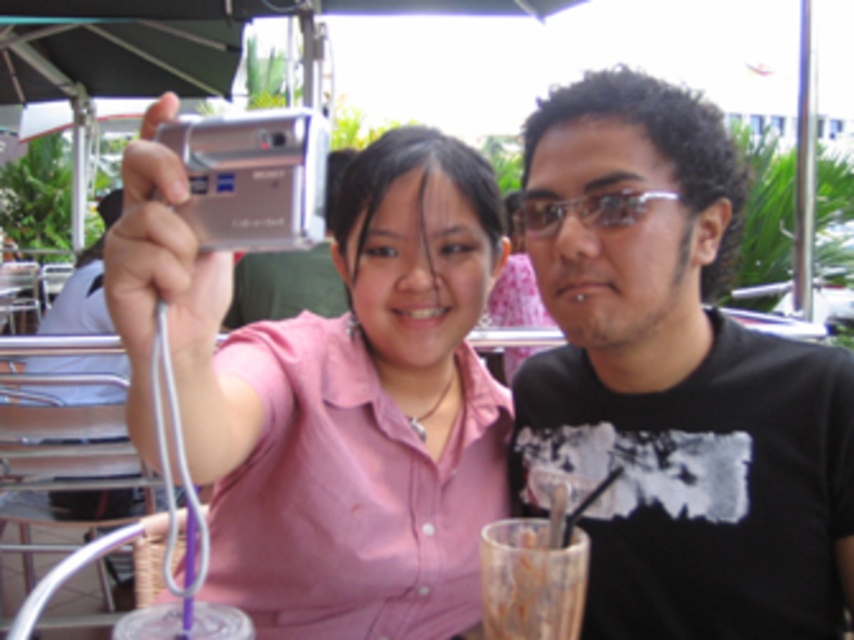
Question: Can you confirm if black matte shirt at right is wider than translucent plastic cup at lower center?

Choices:
 (A) no
 (B) yes

Answer: (B)

Question: Does black matte shirt at right appear on the left side of silver metallic camera at upper left?

Choices:
 (A) yes
 (B) no

Answer: (B)

Question: Which object appears farthest from the camera in this image?

Choices:
 (A) black matte shirt at right
 (B) transparent plastic glasses at center

Answer: (B)

Question: Considering the relative positions of black matte shirt at right and transparent plastic glasses at center in the image provided, where is black matte shirt at right located with respect to transparent plastic glasses at center?

Choices:
 (A) below
 (B) above

Answer: (A)

Question: Which object appears closest to the camera in this image?

Choices:
 (A) silver metallic camera at upper left
 (B) black matte shirt at right

Answer: (A)

Question: Estimate the real-world distances between objects in this image. Which object is closer to the translucent glass cup at lower center?

Choices:
 (A) black matte shirt at right
 (B) silver metallic camera at upper left
 (C) transparent plastic glasses at center

Answer: (A)